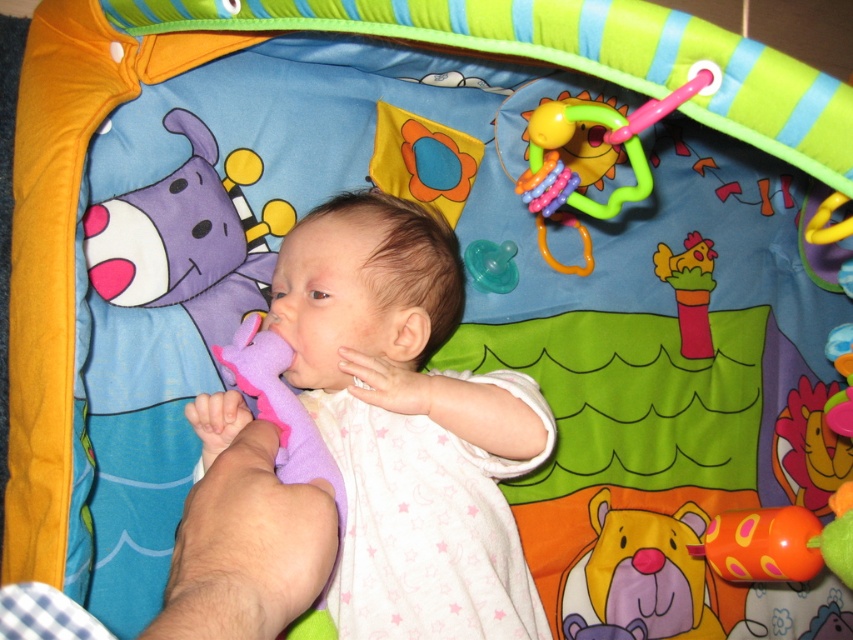
Question: From the image, what is the correct spatial relationship of pink rubber teething ring at upper center in relation to purple rubber teething toy at center?

Choices:
 (A) below
 (B) above

Answer: (B)

Question: Considering the real-world distances, which object is closest to the pink rubber chicken at upper right?

Choices:
 (A) purple rubber teething ring at center
 (B) orange rubber teething ring at lower right
 (C) purple soft plush bear at center

Answer: (C)

Question: Which object is farther from the camera taking this photo?

Choices:
 (A) orange rubber teething ring at lower right
 (B) purple soft plush bear at center
 (C) purple rubber teething ring at center

Answer: (B)

Question: Estimate the real-world distances between objects in this image. Which object is closer to the purple soft plush bear at center?

Choices:
 (A) orange rubber teething ring at lower right
 (B) purple soft toy at center

Answer: (A)

Question: Does purple soft plush bear at center have a larger size compared to purple rubber teething ring at center?

Choices:
 (A) no
 (B) yes

Answer: (B)

Question: In this image, where is purple soft toy at center located relative to orange rubber teething ring at lower right?

Choices:
 (A) left
 (B) right

Answer: (A)